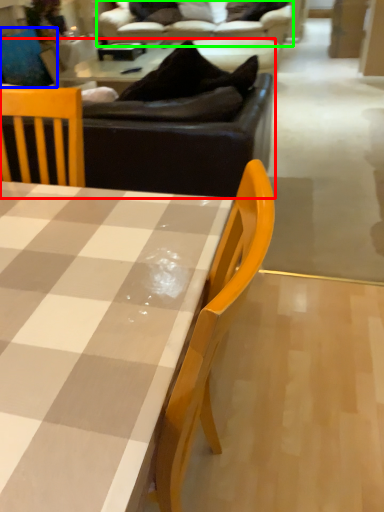
Question: Which object is positioned closest to studio couch (highlighted by a red box)? Select from swivel chair (highlighted by a blue box) and studio couch (highlighted by a green box).

Choices:
 (A) swivel chair
 (B) studio couch

Answer: (B)